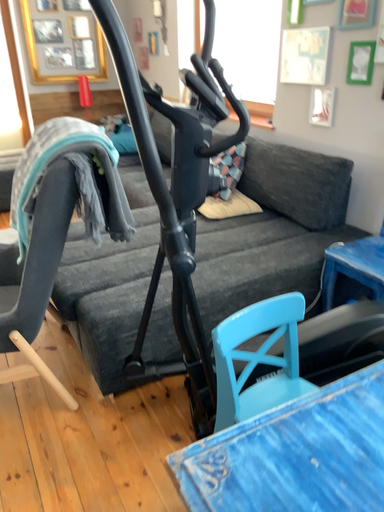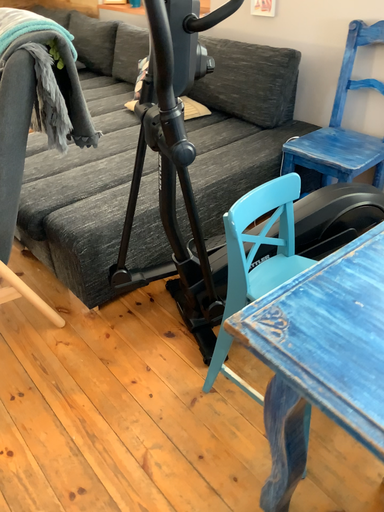
Question: Which way did the camera rotate in the video?

Choices:
 (A) rotated downward
 (B) rotated upward

Answer: (A)